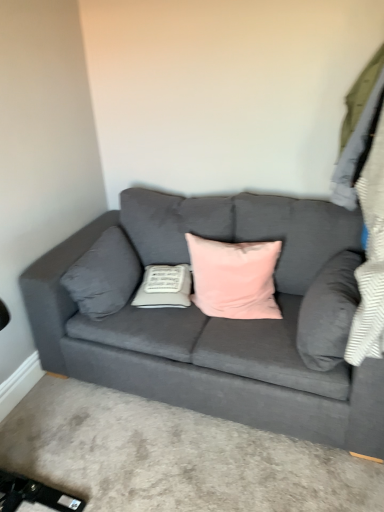
Question: Considering the positions of point (127, 246) and point (273, 311), is point (127, 246) closer or farther from the camera than point (273, 311)?

Choices:
 (A) farther
 (B) closer

Answer: (A)

Question: Is gray fabric pillow at left, the 4th pillow viewed from the right, taller or shorter than pink velvet pillow at center, the third pillow in the left-to-right sequence?

Choices:
 (A) tall
 (B) short

Answer: (B)

Question: Considering the real-world distances, which object is closest to the velvet gray couch at center?

Choices:
 (A) velvet gray pillow at right, the fourth pillow from the left
 (B) gray fabric pillow at left, marked as the 1th pillow in a left-to-right arrangement
 (C) white fabric pillow at center, the third pillow in the right-to-left sequence
 (D) pink velvet pillow at center, the third pillow in the left-to-right sequence

Answer: (D)

Question: Based on their relative distances, which object is nearer to the velvet gray pillow at right, marked as the first pillow in a right-to-left arrangement?

Choices:
 (A) gray fabric pillow at left, marked as the 1th pillow in a left-to-right arrangement
 (B) white fabric pillow at center, the third pillow in the right-to-left sequence
 (C) pink velvet pillow at center, placed as the 2th pillow when sorted from right to left
 (D) velvet gray couch at center

Answer: (C)